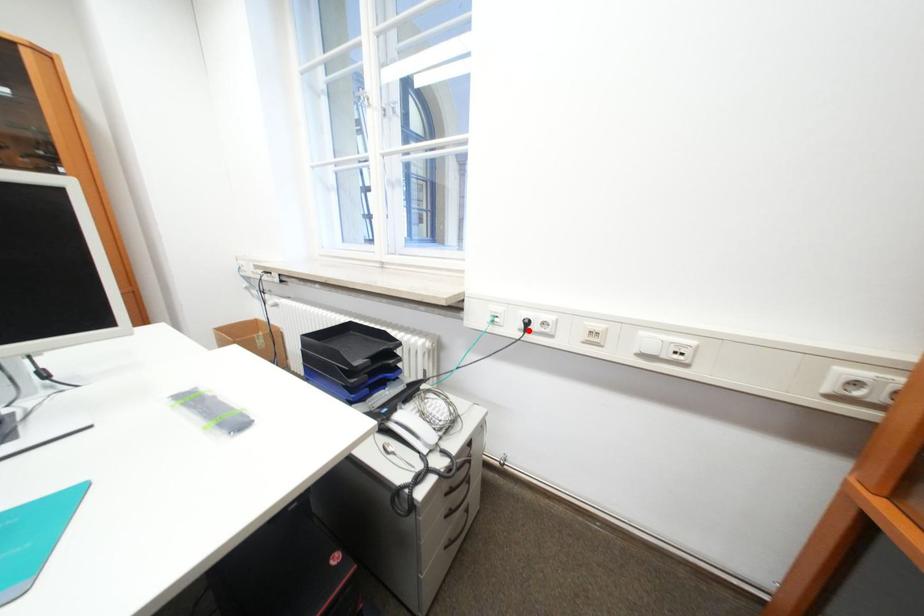
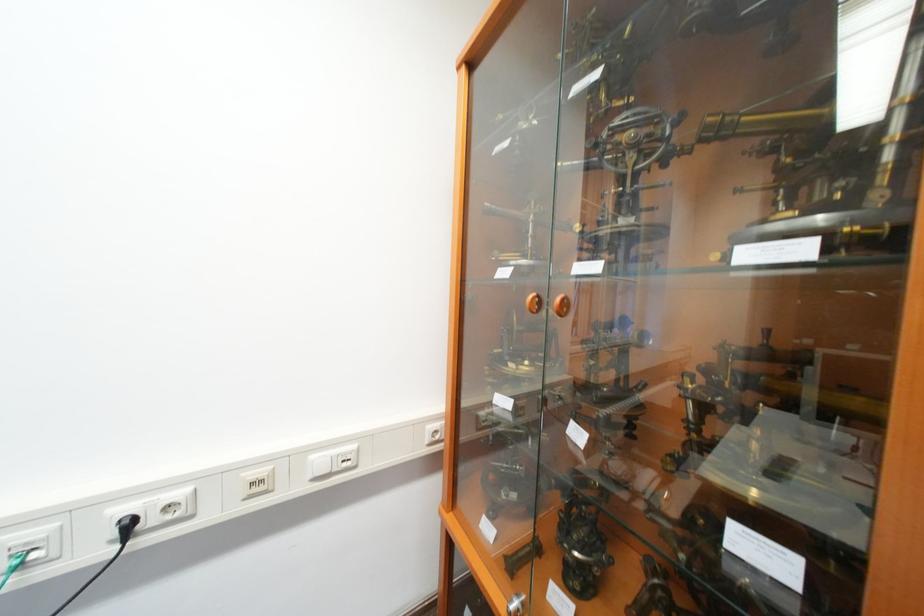
Question: A red point is marked in image1. In image2, is the corresponding 3D point closer to the camera or farther? Reply with the corresponding letter.

Choices:
 (A) The corresponding 3D point is closer.
 (B) The corresponding 3D point is farther.

Answer: (A)